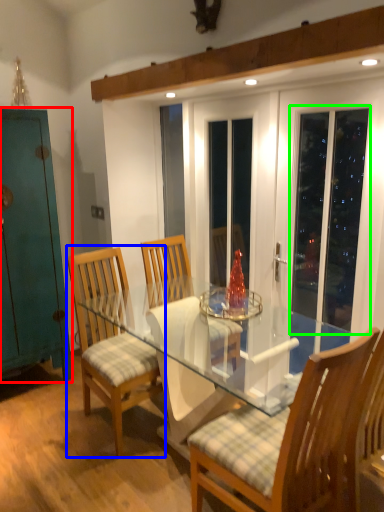
Question: Considering the real-world distances, which object is closest to cabinetry (highlighted by a red box)? chair (highlighted by a blue box) or screen door (highlighted by a green box).

Choices:
 (A) chair
 (B) screen door

Answer: (A)